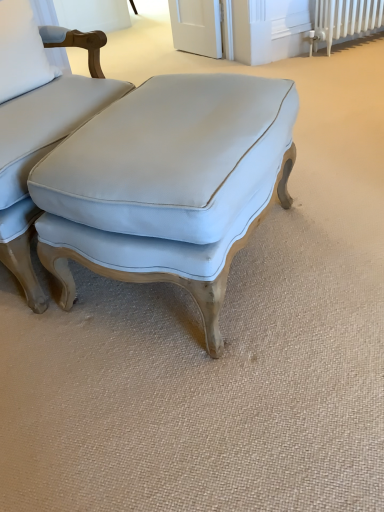
Question: From the image's perspective, would you say light blue fabric ottoman at center is positioned over matte white cushion at center?

Choices:
 (A) no
 (B) yes

Answer: (A)

Question: Considering the relative positions of light blue fabric ottoman at center and matte white cushion at center in the image provided, is light blue fabric ottoman at center to the left of matte white cushion at center from the viewer's perspective?

Choices:
 (A) yes
 (B) no

Answer: (B)

Question: Considering the relative sizes of light blue fabric ottoman at center and matte white cushion at center in the image provided, is light blue fabric ottoman at center wider than matte white cushion at center?

Choices:
 (A) yes
 (B) no

Answer: (B)

Question: Is light blue fabric ottoman at center next to matte white cushion at center and touching it?

Choices:
 (A) yes
 (B) no

Answer: (B)

Question: Is light blue fabric ottoman at center aimed at matte white cushion at center?

Choices:
 (A) yes
 (B) no

Answer: (A)

Question: Based on their positions, is white painted metal radiator at upper right located to the left or right of matte white cushion at center?

Choices:
 (A) right
 (B) left

Answer: (A)

Question: From a real-world perspective, relative to matte white cushion at center, is white painted metal radiator at upper right vertically above or below?

Choices:
 (A) below
 (B) above

Answer: (A)

Question: Is white painted metal radiator at upper right situated inside matte white cushion at center or outside?

Choices:
 (A) outside
 (B) inside

Answer: (A)

Question: Is point (370, 3) positioned closer to the camera than point (76, 117)?

Choices:
 (A) closer
 (B) farther

Answer: (B)

Question: Is light blue fabric ottoman at center in front of or behind matte white cushion at center in the image?

Choices:
 (A) front
 (B) behind

Answer: (A)

Question: From the image's perspective, relative to matte white cushion at center, is light blue fabric ottoman at center above or below?

Choices:
 (A) above
 (B) below

Answer: (B)

Question: Is light blue fabric ottoman at center inside or outside of matte white cushion at center?

Choices:
 (A) inside
 (B) outside

Answer: (B)

Question: Would you say light blue fabric ottoman at center is to the left or to the right of matte white cushion at center in the picture?

Choices:
 (A) right
 (B) left

Answer: (A)

Question: Is white fabric pillow at upper left in front of or behind light blue fabric ottoman at center in the image?

Choices:
 (A) behind
 (B) front

Answer: (A)

Question: Is white fabric pillow at upper left bigger or smaller than light blue fabric ottoman at center?

Choices:
 (A) big
 (B) small

Answer: (B)